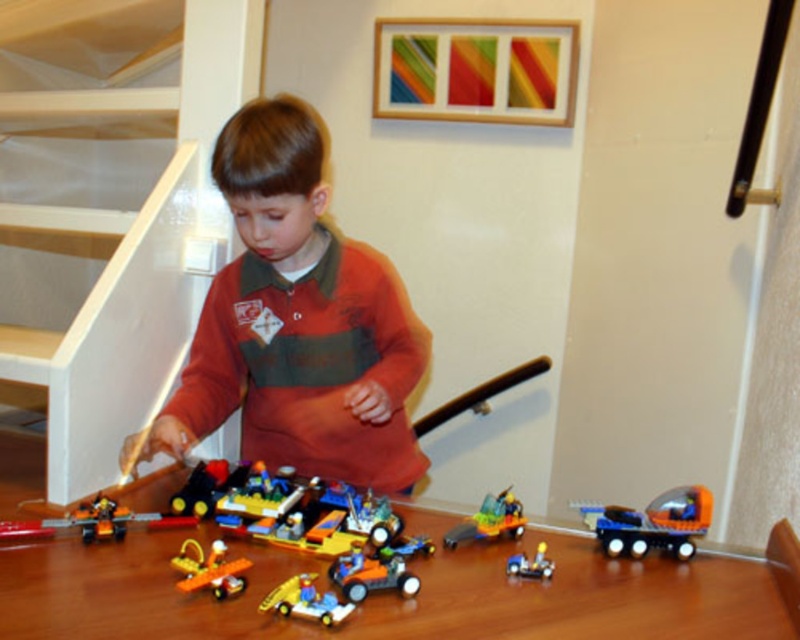
Question: Which point is farther to the camera?

Choices:
 (A) orange matte shirt at center
 (B) translucent orange car at center
 (C) translucent yellow car at center
 (D) brown wooden table at center

Answer: (B)

Question: Estimate the real-world distances between objects in this image. Which object is farther from the orange matte car at center?

Choices:
 (A) brown wooden table at center
 (B) translucent orange airplane at lower left

Answer: (A)

Question: Can you confirm if orange matte shirt at center is wider than translucent orange airplane at lower left?

Choices:
 (A) no
 (B) yes

Answer: (B)

Question: Can you confirm if orange matte shirt at center is smaller than blue plastic truck at lower right?

Choices:
 (A) no
 (B) yes

Answer: (A)

Question: Is orange matte shirt at center below shiny metallic car at lower center?

Choices:
 (A) no
 (B) yes

Answer: (A)

Question: Which point appears farthest from the camera in this image?

Choices:
 (A) (214, 579)
 (B) (406, 580)

Answer: (B)